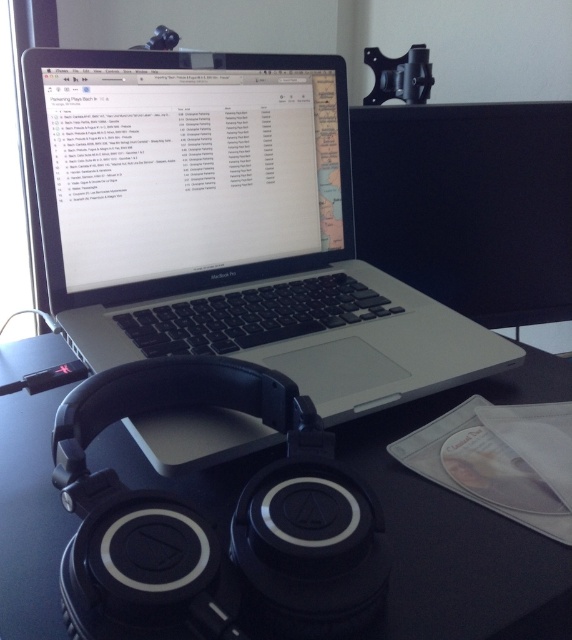
Who is shorter, black matte headphones at center or black glossy monitor at upper center?

Standing shorter between the two is black matte headphones at center.

Which is more to the right, black matte headphones at center or black glossy monitor at upper center?

black glossy monitor at upper center is more to the right.

The width and height of the screenshot is (572, 640). Describe the element at coordinates (462, 528) in the screenshot. I see `black matte headphones at center` at that location.

Image resolution: width=572 pixels, height=640 pixels. Identify the location of black matte headphones at center. (462, 528).

Can you confirm if sleek silver laptop at center is smaller than black glossy monitor at upper center?

No, sleek silver laptop at center is not smaller than black glossy monitor at upper center.

Does point (73, 180) come closer to viewer compared to point (545, 141)?

That is True.

Based on the photo, who is more forward, (442, 348) or (478, 177)?

Point (442, 348)

I want to click on sleek silver laptop at center, so click(x=227, y=227).

Is sleek silver laptop at center shorter than satin black laptop at center?

Incorrect, sleek silver laptop at center's height does not fall short of satin black laptop at center's.

Which is below, sleek silver laptop at center or satin black laptop at center?

sleek silver laptop at center is below.

Who is more forward, (380, 397) or (280, 108)?

Point (380, 397)

In order to click on sleek silver laptop at center in this screenshot , I will do tap(227, 227).